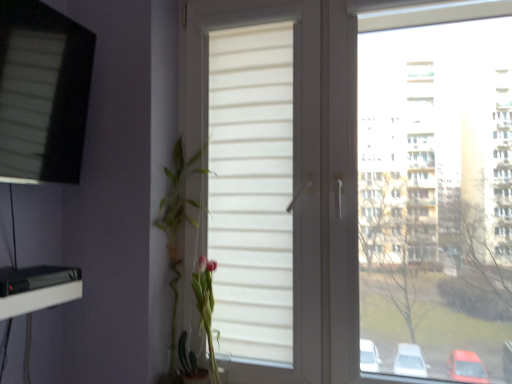
Question: Considering the relative sizes of green leafy plant at left and matte black screen at upper left, the first window from the left, in the image provided, is green leafy plant at left smaller than matte black screen at upper left, the first window from the left,?

Choices:
 (A) yes
 (B) no

Answer: (A)

Question: Does green leafy plant at left turn towards matte black screen at upper left, which appears as the 2th window when viewed from the right?

Choices:
 (A) yes
 (B) no

Answer: (B)

Question: Does green leafy plant at left appear on the left side of matte black screen at upper left, which appears as the 2th window when viewed from the right?

Choices:
 (A) yes
 (B) no

Answer: (B)

Question: Is matte black screen at upper left, which appears as the 2th window when viewed from the right, surrounded by green leafy plant at left?

Choices:
 (A) yes
 (B) no

Answer: (B)

Question: Does green leafy plant at left have a greater height compared to matte black screen at upper left, which appears as the 2th window when viewed from the right?

Choices:
 (A) no
 (B) yes

Answer: (B)

Question: Is green leafy plant at left looking in the opposite direction of matte black screen at upper left, the first window from the left?

Choices:
 (A) no
 (B) yes

Answer: (A)

Question: Is matte black screen at upper left, the first window from the left, smaller than green leafy plant at left?

Choices:
 (A) no
 (B) yes

Answer: (A)

Question: Does matte black screen at upper left, which appears as the 2th window when viewed from the right, turn towards green leafy plant at left?

Choices:
 (A) no
 (B) yes

Answer: (A)

Question: From the image's perspective, does matte black screen at upper left, which appears as the 2th window when viewed from the right, appear lower than green leafy plant at left?

Choices:
 (A) no
 (B) yes

Answer: (A)

Question: From a real-world perspective, is matte black screen at upper left, which appears as the 2th window when viewed from the right, on top of green leafy plant at left?

Choices:
 (A) no
 (B) yes

Answer: (B)

Question: Does matte black screen at upper left, the first window from the left, appear on the right side of green leafy plant at left?

Choices:
 (A) no
 (B) yes

Answer: (A)

Question: From a real-world perspective, is matte black screen at upper left, the first window from the left, positioned under green leafy plant at left based on gravity?

Choices:
 (A) yes
 (B) no

Answer: (B)

Question: Does green leafy plant at left have a smaller size compared to white matte window at center, the first window when ordered from right to left?

Choices:
 (A) yes
 (B) no

Answer: (A)